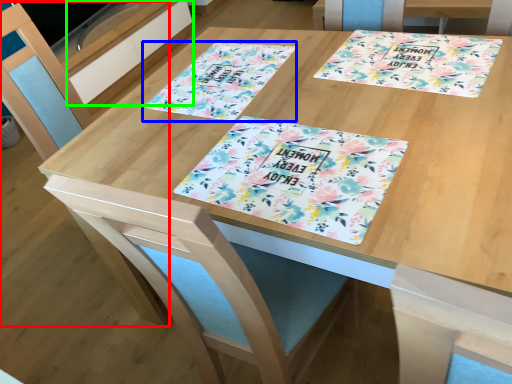
Question: Which object is positioned farthest from chair (highlighted by a red box)? Select from flyer (highlighted by a blue box) and drawer (highlighted by a green box).

Choices:
 (A) flyer
 (B) drawer

Answer: (B)